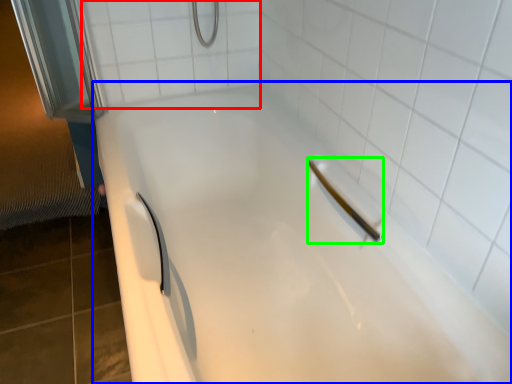
Question: Which is nearer to the ceramic tile (highlighted by a red box)? bathtub (highlighted by a blue box) or shower (highlighted by a green box).

Choices:
 (A) bathtub
 (B) shower

Answer: (A)